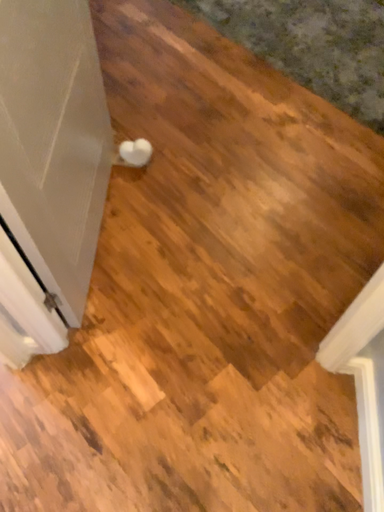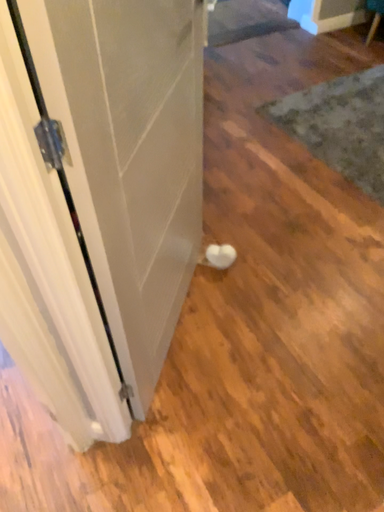
Question: Which way did the camera rotate in the video?

Choices:
 (A) rotated downward
 (B) rotated upward

Answer: (B)